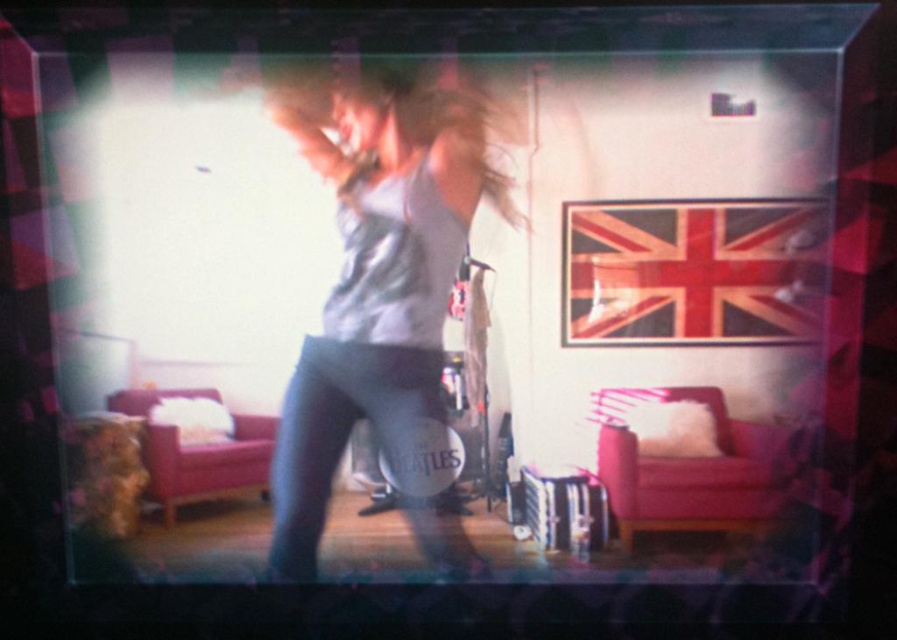
Can you confirm if gray matte tank top at center is positioned to the right of blonde silky hair at center?

No, gray matte tank top at center is not to the right of blonde silky hair at center.

Where is `gray matte tank top at center`? The image size is (897, 640). gray matte tank top at center is located at coordinates (377, 292).